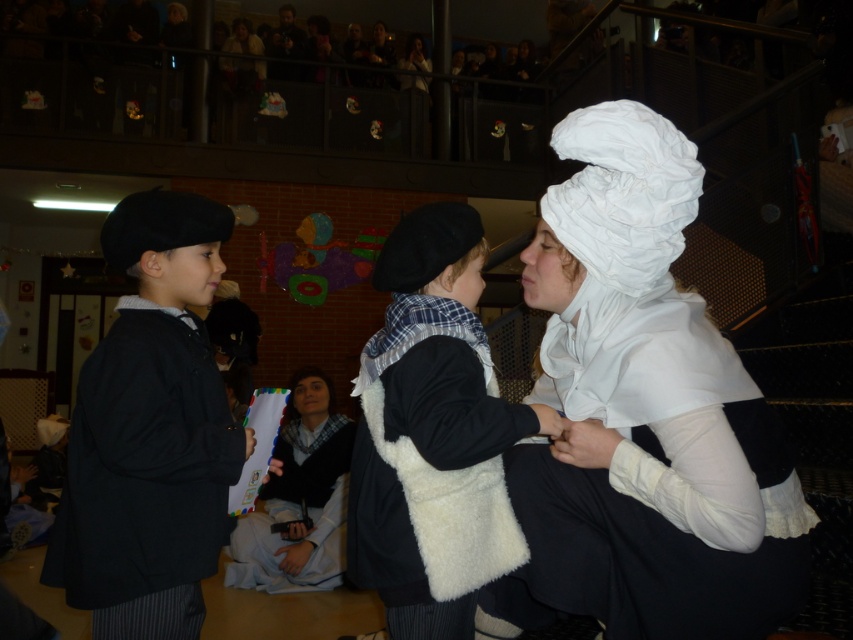
You are organizing a costume party and need to decide which item to place on a small shelf. The shelf can only hold items that are not too large. Given the white satin bonnet at center and the white fluffy vest at center, which item should you choose to ensure it fits?

The white fluffy vest at center is smaller than the white satin bonnet at center, so you should choose the white fluffy vest at center to ensure it fits on the small shelf.

You are standing in the front row of the audience watching the event. You want to hand a gift to the person wearing the white satin bonnet at center and the person wearing the matte black coat at left. Which one can you reach by walking straight forward without moving sideways?

The white satin bonnet at center is closer to the viewer than the matte black coat at left, so you can reach the person wearing the white satin bonnet at center by walking straight forward without moving sideways.

You are planning to place a decorative item on a shelf that can only hold items up to the width of the matte black coat at left. Can the white satin bonnet at center fit on the shelf based on their widths?

The white satin bonnet at center might be wider than matte black coat at left, so it may not fit on the shelf if the shelf can only hold items up to the width of the matte black coat at left.